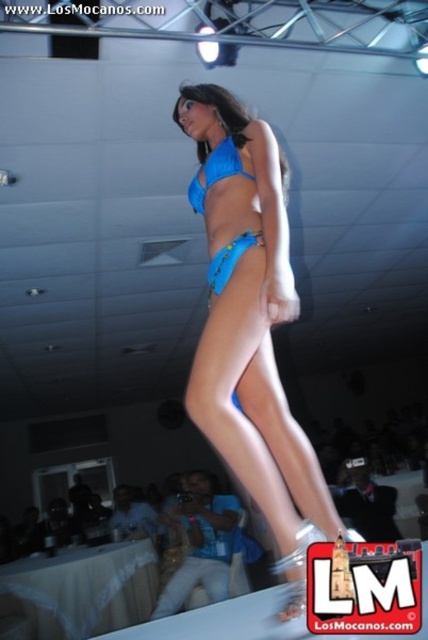
Who is positioned more to the left, blue shiny bikini at center or blue matte bikini top at center?

Positioned to the left is blue matte bikini top at center.

Can you confirm if blue shiny bikini at center is shorter than blue matte bikini top at center?

No.

Image resolution: width=428 pixels, height=640 pixels. What are the coordinates of `blue shiny bikini at center` in the screenshot? It's located at (250, 326).

Locate an element on the screen. blue shiny bikini at center is located at coordinates pos(250,326).

The image size is (428, 640). Find the location of `blue matte bikini at center`. blue matte bikini at center is located at coordinates (216, 172).

Can you confirm if blue matte bikini at center is positioned to the right of blue matte bikini top at center?

No, blue matte bikini at center is not to the right of blue matte bikini top at center.

At what (x,y) coordinates should I click in order to perform the action: click on blue matte bikini at center. Please return your answer as a coordinate pair (x, y). The image size is (428, 640). Looking at the image, I should click on (216, 172).

Which of these two, blue shiny bikini at center or blue matte bikini at center, stands taller?

blue shiny bikini at center is taller.

Is blue shiny bikini at center taller than blue matte bikini at center?

Correct, blue shiny bikini at center is much taller as blue matte bikini at center.

What do you see at coordinates (250, 326) in the screenshot?
I see `blue shiny bikini at center` at bounding box center [250, 326].

Locate an element on the screen. blue shiny bikini at center is located at coordinates (250, 326).